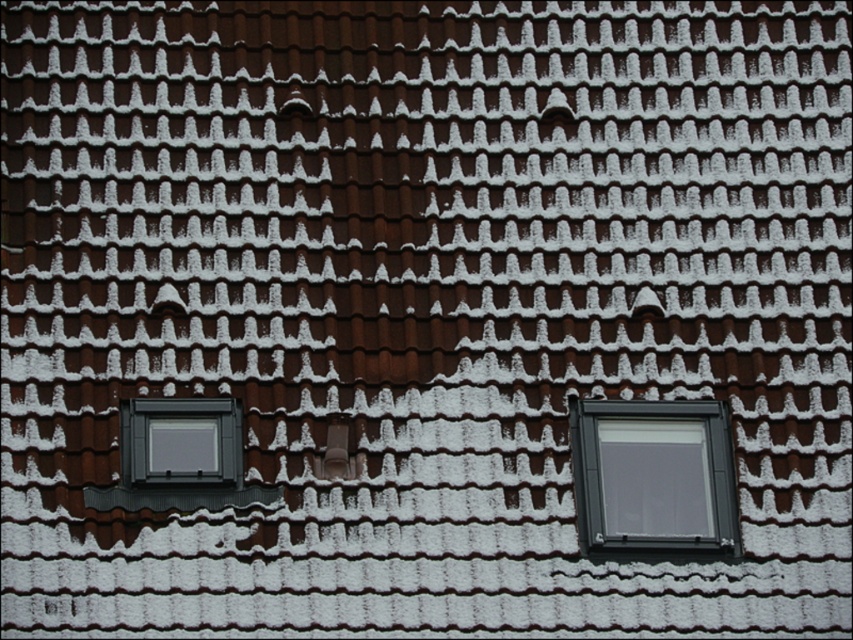
In the scene shown: You are standing on the roof and want to place a new solar panel. The solar panel requires a clear, snowless area. The roof has a matte gray window at right. Where should you place the solar panel to avoid the window and any snow? Use coordinates to specify the location.

The matte gray window at right is located at coordinates point (653, 476). To place the solar panel away from the window and snow, choose an area without snow accumulation and not near the window coordinates.

You are on the roof and want to move from the matte gray window at lower left to the matte gray window at right. Which direction should you move in?

You should move to the right to reach the matte gray window at right from the matte gray window at lower left since it is positioned to the right of it.

You are a maintenance worker needing to replace a window. You have a ladder that is 20 feet long. You are standing at the base of the building and need to reach both the matte gray window at right and the matte gray window at lower left. Can you reach both windows with your ladder without moving it?

The matte gray window at right and the matte gray window at lower left are 19.75 feet apart from each other. Since the ladder is 20 feet long, it can span the distance between them, so yes, you can reach both windows with the ladder without moving it.